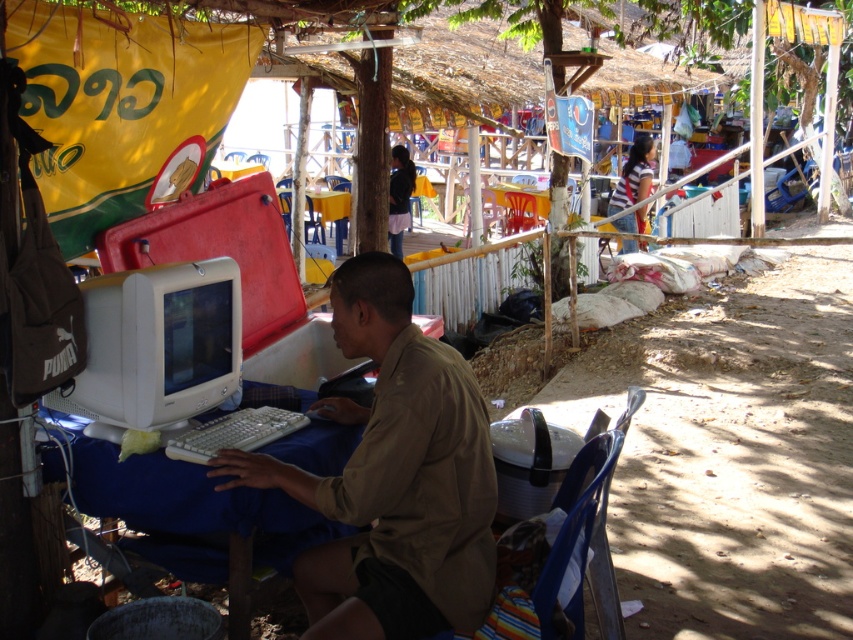
You are a photographer taking a picture of the scene. You want to ensure both the matte beige shirt at center and the white plastic table at center are clearly visible. Based on their positions, which object is closer to the camera?

The matte beige shirt at center is in front of the white plastic table at center, so it is closer to the camera.

You are standing in the outdoor setting shown in the image and want to locate the matte beige shirt at center. Could you describe its exact location using the coordinate system provided?

The matte beige shirt at center is located at the coordinate point of 0.747 on the x axis and 0.462 on the y axis.